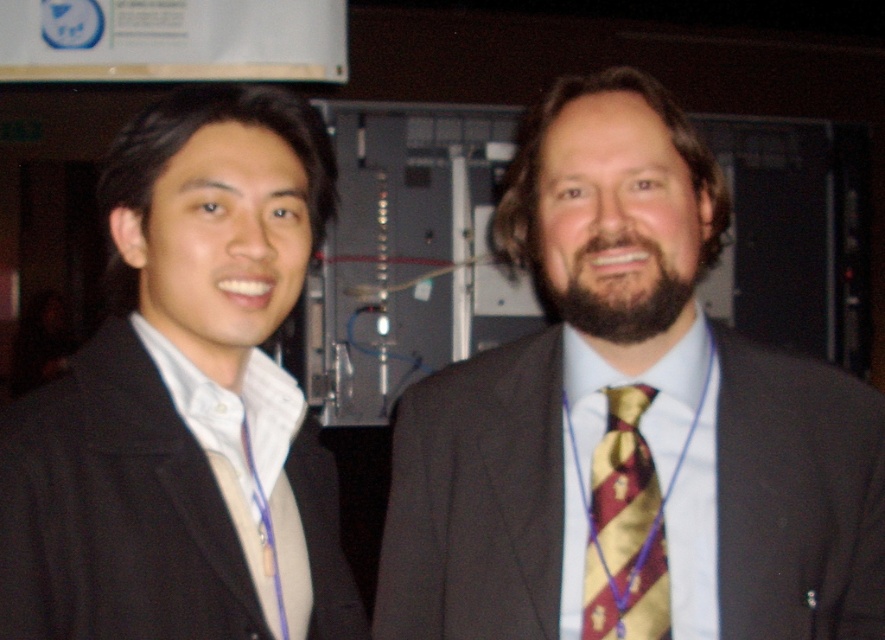
Question: Among these objects, which one is farthest from the camera?

Choices:
 (A) maroon striped tie at center
 (B) maroon and gold striped tie at center

Answer: (A)

Question: Can you confirm if maroon and gold striped tie at center is positioned to the left of black matte suit at left?

Choices:
 (A) yes
 (B) no

Answer: (B)

Question: Which object appears farthest from the camera in this image?

Choices:
 (A) maroon striped tie at center
 (B) black matte suit at left

Answer: (A)

Question: Can you confirm if maroon and gold striped tie at center is positioned to the right of black matte suit at left?

Choices:
 (A) yes
 (B) no

Answer: (A)

Question: Considering the real-world distances, which object is closest to the maroon and gold striped tie at center?

Choices:
 (A) maroon striped tie at center
 (B) black matte suit at left

Answer: (A)

Question: Is maroon and gold striped tie at center closer to camera compared to maroon striped tie at center?

Choices:
 (A) yes
 (B) no

Answer: (A)